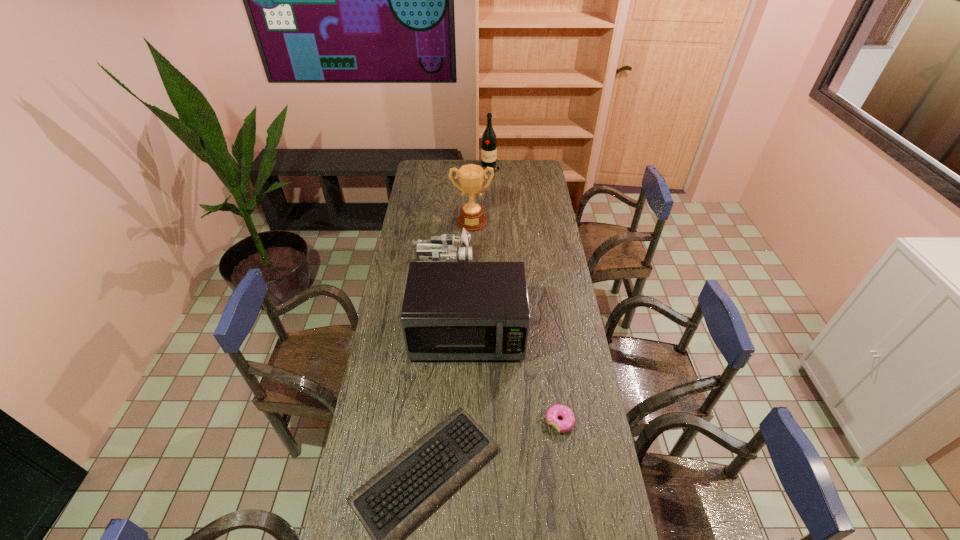
Image resolution: width=960 pixels, height=540 pixels. I want to click on vacant space that satisfies the following two spatial constraints: 1. on the front-facing side of the rightmost object; 2. on the right side of the microwave oven, so click(466, 422).

You are a GUI agent. You are given a task and a screenshot of the screen. Output one action in this format:
    pyautogui.click(x=<x>, y=<y>)
    Task: Click on the free point that satisfies the following two spatial constraints: 1. on the front-facing side of the award; 2. on the front-facing side of the third farthest object
    
    Given the screenshot: What is the action you would take?
    pyautogui.click(x=471, y=261)

You are a GUI agent. You are given a task and a screenshot of the screen. Output one action in this format:
    pyautogui.click(x=<x>, y=<y>)
    Task: Click on the vacant area in the image that satisfies the following two spatial constraints: 1. on the front-facing side of the rightmost object; 2. on the left side of the fourth nearest object
    This screenshot has height=540, width=960.
    Given the screenshot: What is the action you would take?
    pyautogui.click(x=429, y=422)